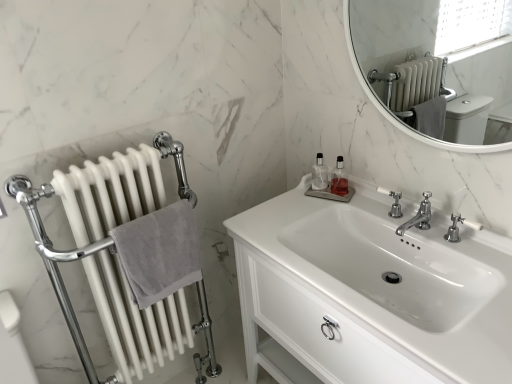
Find the location of a particular element. This screenshot has width=512, height=384. free space that is in between polished chrome faucet at center, which ranks as the 1th tap in left-to-right order, and polished chrome faucet at upper right is located at coordinates (389, 223).